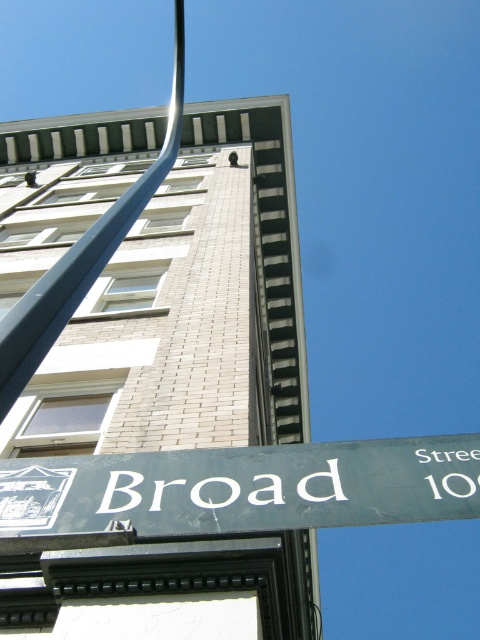
You are a pedestrian standing at the corner of Broad Street. You want to take a photo of the blue metallic pole at upper left without the green matte street sign at lower center blocking the view. Is this possible?

The blue metallic pole at upper left is behind the green matte street sign at lower center, so it is already obscured by the sign. Therefore, you cannot take a photo of the blue metallic pole at upper left without the green matte street sign at lower center blocking the view.

You are a city planner assessing the visibility of street signs. Given the scene, which object between the green matte street sign at lower center and the blue metallic pole at upper left would be more noticeable from a distance? Explain your reasoning based on their sizes as shown in the image.

The blue metallic pole at upper left is larger than the green matte street sign at lower center, making it more noticeable from a distance.